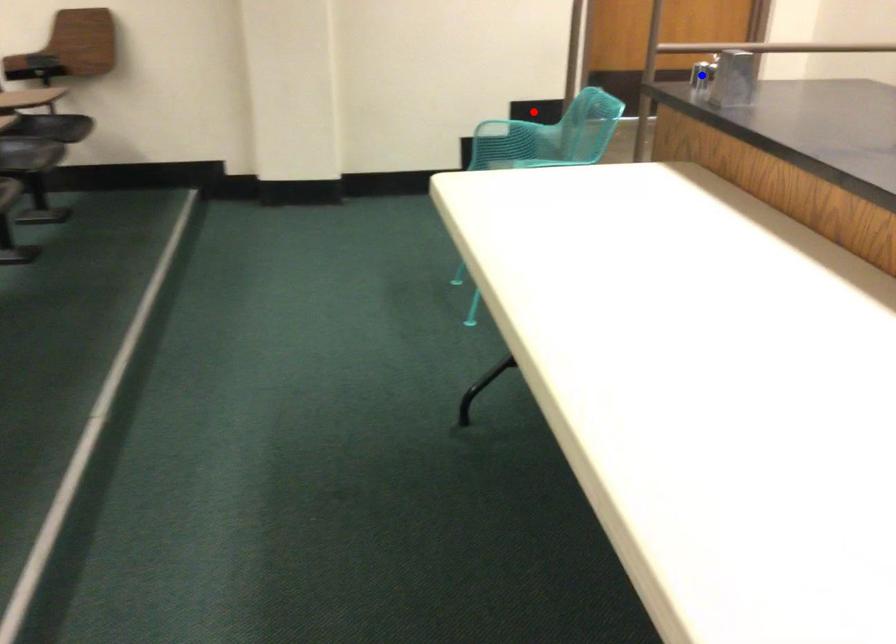
Question: Which of the two points in the image is closer to the camera?

Choices:
 (A) Blue point is closer.
 (B) Red point is closer.

Answer: (A)